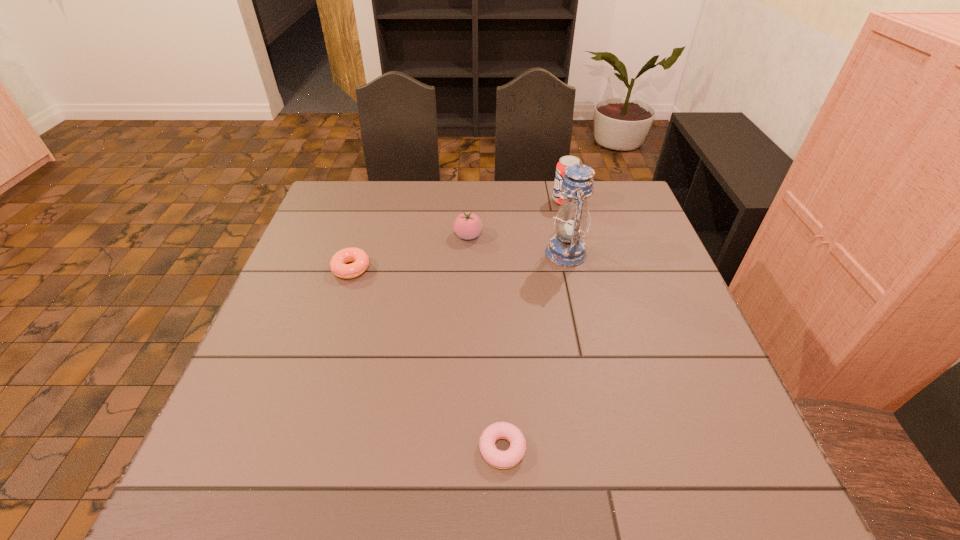
Image resolution: width=960 pixels, height=540 pixels. I want to click on vacant space at the far edge, so click(534, 198).

I want to click on blank space at the near edge of the desktop, so click(x=299, y=475).

In the image, there is a desktop. In order to click on free space at the left edge in this screenshot , I will do `click(302, 321)`.

Identify the location of free location at the right edge. The height and width of the screenshot is (540, 960). (661, 256).

Image resolution: width=960 pixels, height=540 pixels. I want to click on free space at the far left corner, so click(x=327, y=196).

Locate an element on the screen. free space at the far right corner of the desktop is located at coordinates (596, 211).

The height and width of the screenshot is (540, 960). I want to click on vacant space at the near right corner, so click(x=745, y=455).

Find the location of `vacant point located between the third shortest object and the left doughnut`. vacant point located between the third shortest object and the left doughnut is located at coordinates (410, 252).

At what (x,y) coordinates should I click in order to perform the action: click on vacant space that's between the lantern and the third shortest object. Please return your answer as a coordinate pair (x, y). Looking at the image, I should click on (517, 245).

Locate an element on the screen. free space between the shorter doughnut and the farthest object is located at coordinates (533, 325).